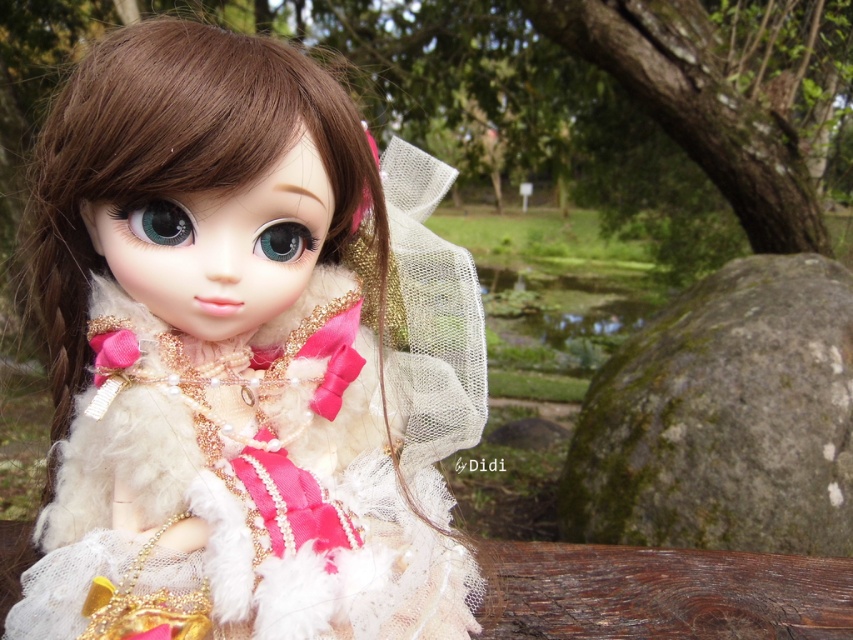
You are a photographer setting up a shot of the doll. You want to position a small flower bouquet between the fuzzy white dress at center and the green mossy rock at lower right. Based on their positions, which side of the dress should the bouquet be placed to ensure it is between both objects?

The fuzzy white dress at center is to the left of the green mossy rock at lower right, so the bouquet should be placed to the right of the fuzzy white dress at center to be between them.

You are a photographer setting up a shot of the doll. You want to ensure the fuzzy white dress at center is visible without being blocked. Should you move the green mossy rock at lower right closer to or further away from the camera?

The fuzzy white dress at center is currently in front of the green mossy rock at lower right. To keep the dress visible and unobstructed, you should move the green mossy rock at lower right further away from the camera so it doesn t block the dress.

You are a photographer trying to capture the fuzzy white dress at center in a doll image. The image has a coordinate system where the bottom left corner is the origin. If you want to focus on the dress, where should you aim your camera? Please provide the coordinates as a point in the format of a tuple.

The fuzzy white dress at center is located at point coordinates of (244, 355). So, you should aim your camera at the point coordinates of (244, 355) to focus on the fuzzy white dress at center.